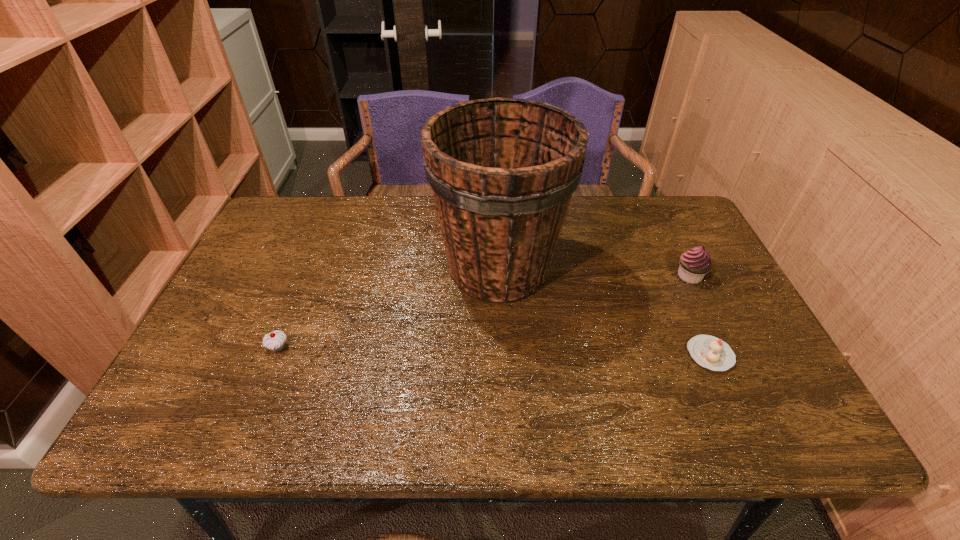
You are a GUI agent. You are given a task and a screenshot of the screen. Output one action in this format:
    pyautogui.click(x=<x>, y=<y>)
    Task: Click on the bucket
    
    Given the screenshot: What is the action you would take?
    502,171

Locate an element on the screen. the third object from right to left is located at coordinates (502, 171).

This screenshot has width=960, height=540. I want to click on the tallest cupcake, so click(x=695, y=263).

Locate an element on the screen. The image size is (960, 540). the farthest cupcake is located at coordinates (695, 263).

This screenshot has width=960, height=540. Identify the location of the second tallest cupcake. (275, 341).

At what (x,y) coordinates should I click in order to perform the action: click on the leftmost cupcake. Please return your answer as a coordinate pair (x, y). Looking at the image, I should click on (275, 341).

Find the location of a particular element. The image size is (960, 540). the shortest cupcake is located at coordinates (708, 351).

The height and width of the screenshot is (540, 960). I want to click on vacant space located on the right of the bucket, so click(650, 268).

Identify the location of vacant region located on the back of the farthest cupcake. This screenshot has width=960, height=540. (671, 239).

Where is `blank space located 0.260m on the right of the leftmost cupcake`? This screenshot has height=540, width=960. blank space located 0.260m on the right of the leftmost cupcake is located at coordinates (400, 347).